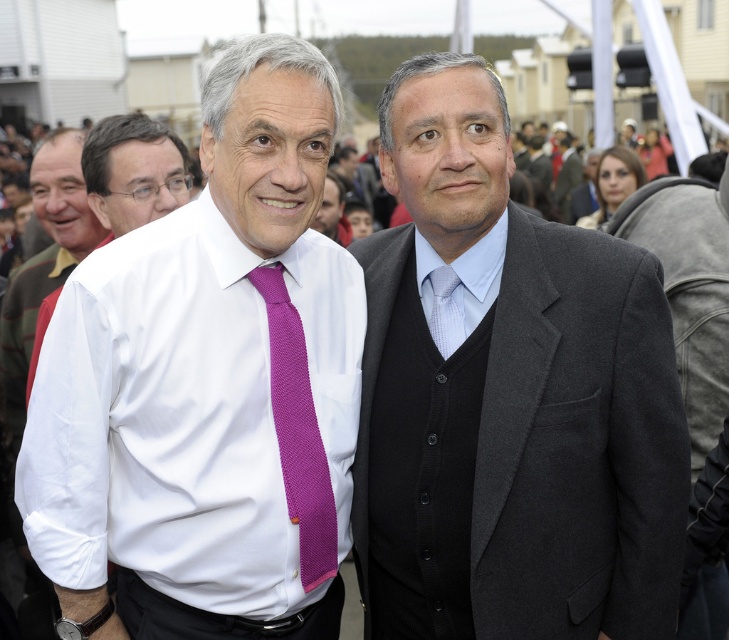
You are a photographer at a busy event. You need to capture a clear photo of both the white knitted dress shirt at center and the white woven shirt at center. Given their sizes, which one might require you to zoom in more to focus on details?

The white woven shirt at center is smaller in size than the white knitted dress shirt at center, so you would need to zoom in more to focus on the details of the white woven shirt at center.

You are a photographer trying to capture the dark gray suit at center. You notice a point at coordinates (510,401). Where should you aim your camera to ensure the dark gray suit at center is in focus?

The point at coordinates (510,401) indicates the location of the dark gray suit at center, so aim your camera at that point to ensure the dark gray suit at center is in focus.